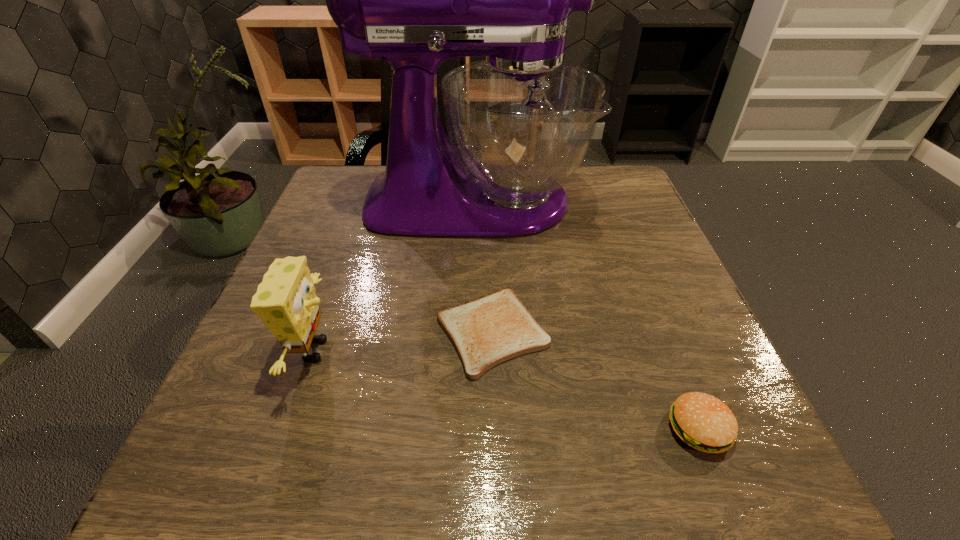
The height and width of the screenshot is (540, 960). Find the location of `free space that satisfies the following two spatial constraints: 1. at the bowl opening of the shortest object; 2. on the right side of the tallest object`. free space that satisfies the following two spatial constraints: 1. at the bowl opening of the shortest object; 2. on the right side of the tallest object is located at coordinates (472, 332).

Where is `free space that satisfies the following two spatial constraints: 1. on the face of the second shortest object; 2. on the right side of the third shortest object`? free space that satisfies the following two spatial constraints: 1. on the face of the second shortest object; 2. on the right side of the third shortest object is located at coordinates (286, 428).

Where is `free space that satisfies the following two spatial constraints: 1. at the bowl opening of the farthest object; 2. on the left side of the toast`? free space that satisfies the following two spatial constraints: 1. at the bowl opening of the farthest object; 2. on the left side of the toast is located at coordinates (472, 332).

The width and height of the screenshot is (960, 540). In order to click on free space that satisfies the following two spatial constraints: 1. on the back side of the toast; 2. at the bowl opening of the mixer in this screenshot , I will do [x=489, y=201].